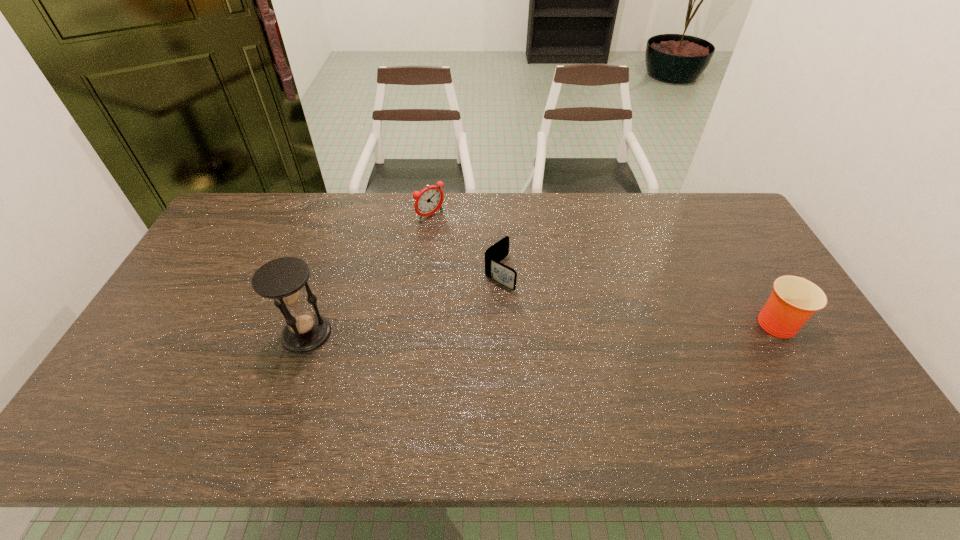
This screenshot has height=540, width=960. I want to click on hourglass, so click(282, 279).

Identify the location of the leftmost object. This screenshot has width=960, height=540. (282, 279).

Where is `the rightmost object`? The image size is (960, 540). the rightmost object is located at coordinates (794, 300).

You are a GUI agent. You are given a task and a screenshot of the screen. Output one action in this format:
    pyautogui.click(x=<x>, y=<y>)
    Task: Click on the second object from right to left
    
    Given the screenshot: What is the action you would take?
    pyautogui.click(x=504, y=275)

What are the coordinates of `wallet` in the screenshot? It's located at (504, 275).

Identify the location of the second object from left to right. (428, 201).

I want to click on alarm clock, so click(x=428, y=201).

In order to click on vacant space located on the left of the hourglass in this screenshot , I will do `click(158, 334)`.

Locate an element on the screen. vacant position located on the left of the rightmost object is located at coordinates (610, 321).

Find the location of a particular element. free space located 0.230m on the outer surface of the second farthest object is located at coordinates (577, 325).